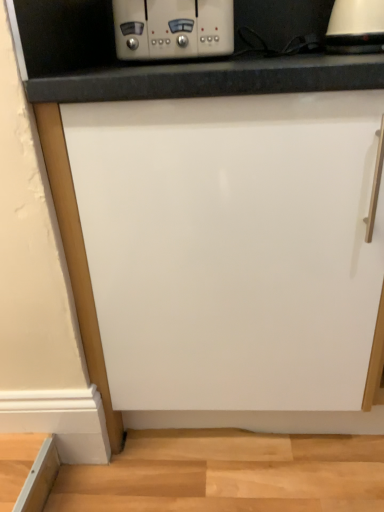
At what (x,y) coordinates should I click in order to perform the action: click on white plastic toaster at upper center. Please return your answer as a coordinate pair (x, y). Looking at the image, I should click on (173, 28).

This screenshot has height=512, width=384. What do you see at coordinates (173, 28) in the screenshot?
I see `white plastic toaster at upper center` at bounding box center [173, 28].

Locate an element on the screen. white plastic toaster at upper center is located at coordinates tap(173, 28).